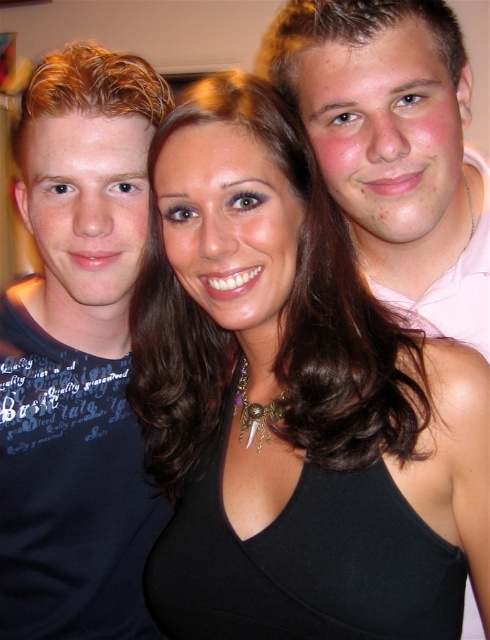
You are standing in front of the three people in the image and want to place a small gift exactly at the point labeled point (125, 288). If your hand can reach up to 80 centimeters, will you be able to reach that point?

The distance of point (125, 288) from the viewer is 82.98 centimeters, which is beyond your hand reach of 80 centimeters. You won not be able to reach the point.

You are trying to decide which shirt to wear for a casual day out. Both the matte blue shirt at left and the pink cotton shirt at right are options. Based on their sizes, which one might be more comfortable for layering under a jacket?

The matte blue shirt at left has a lesser width compared to the pink cotton shirt at right, so it might be more comfortable for layering under a jacket since it is narrower and less likely to bunch up.